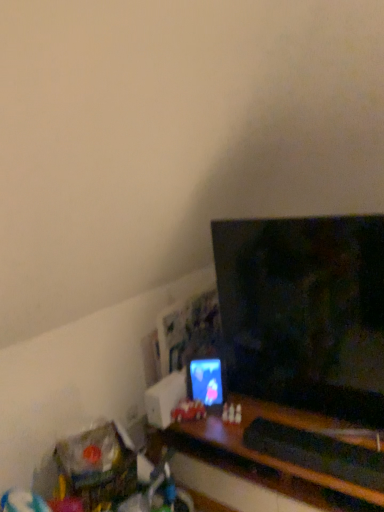
Question: From a real-world perspective, is black glossy tv at center located beneath matte plastic phone at center?

Choices:
 (A) yes
 (B) no

Answer: (B)

Question: Is black glossy tv at center next to matte plastic phone at center and touching it?

Choices:
 (A) yes
 (B) no

Answer: (B)

Question: Is black glossy tv at center thinner than matte plastic phone at center?

Choices:
 (A) yes
 (B) no

Answer: (B)

Question: Can we say black glossy tv at center lies outside matte plastic phone at center?

Choices:
 (A) yes
 (B) no

Answer: (A)

Question: Considering the relative sizes of black glossy tv at center and matte plastic phone at center in the image provided, is black glossy tv at center wider than matte plastic phone at center?

Choices:
 (A) no
 (B) yes

Answer: (B)

Question: Is black glossy tv at center far away from matte plastic phone at center?

Choices:
 (A) yes
 (B) no

Answer: (B)

Question: Is matte plastic phone at center facing away from translucent plastic toy at center?

Choices:
 (A) yes
 (B) no

Answer: (B)

Question: Can you confirm if matte plastic phone at center is smaller than translucent plastic toy at center?

Choices:
 (A) no
 (B) yes

Answer: (A)

Question: Could you tell me if matte plastic phone at center is facing translucent plastic toy at center?

Choices:
 (A) no
 (B) yes

Answer: (B)

Question: Is matte plastic phone at center further to the viewer compared to translucent plastic toy at center?

Choices:
 (A) no
 (B) yes

Answer: (B)

Question: Are matte plastic phone at center and translucent plastic toy at center located far from each other?

Choices:
 (A) yes
 (B) no

Answer: (B)

Question: Does matte plastic phone at center appear on the right side of translucent plastic toy at center?

Choices:
 (A) yes
 (B) no

Answer: (A)

Question: Does translucent plastic toy at center have a greater height compared to black glossy tv at center?

Choices:
 (A) no
 (B) yes

Answer: (A)